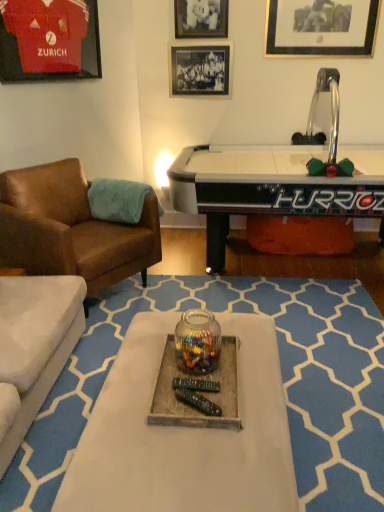
The height and width of the screenshot is (512, 384). Identify the location of free spot to the left of black plastic remote control at center, which is counted as the 2th remote control, starting from the front. (165, 392).